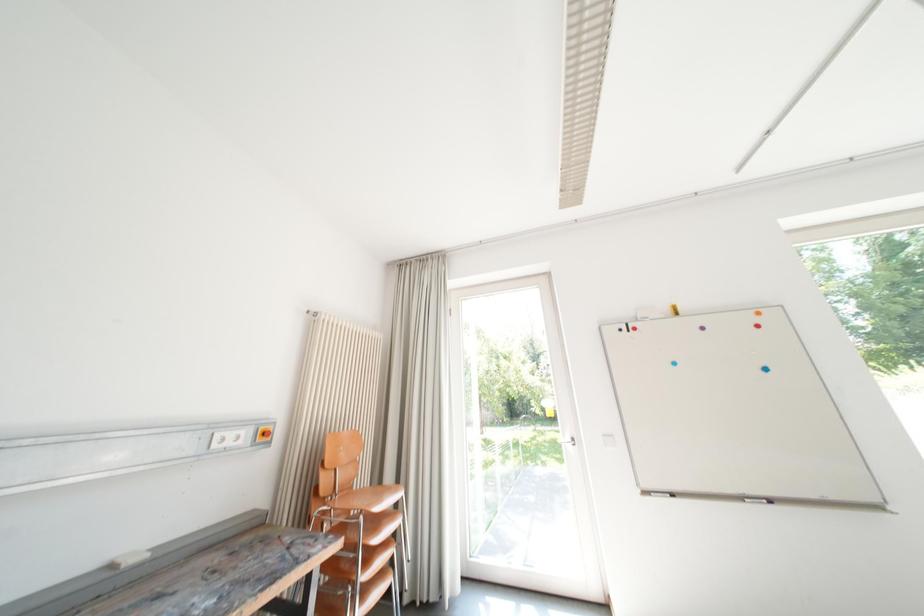
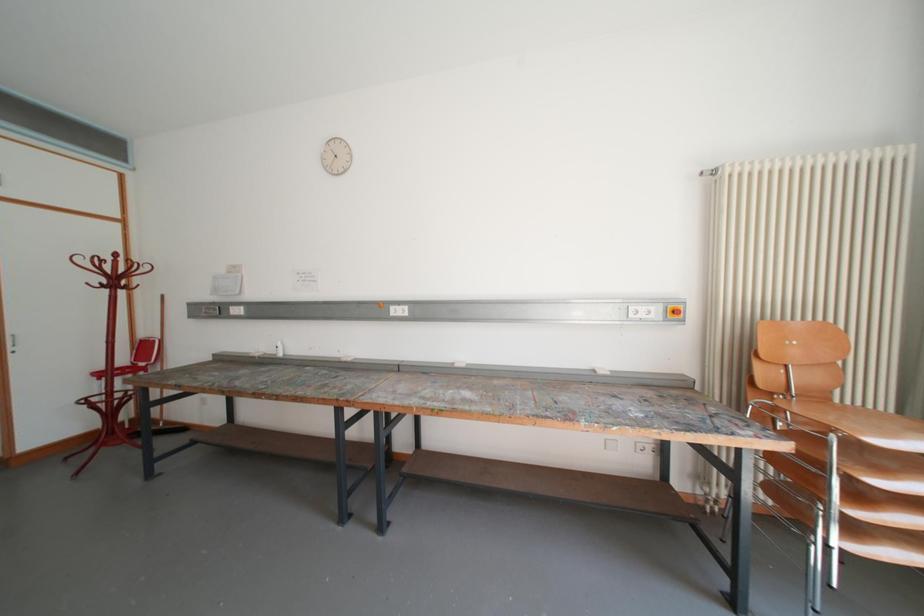
Question: The images are taken continuously from a first-person perspective. In which direction is your viewpoint rotating?

Choices:
 (A) Left
 (B) Right
 (C) Up
 (D) Down

Answer: (A)